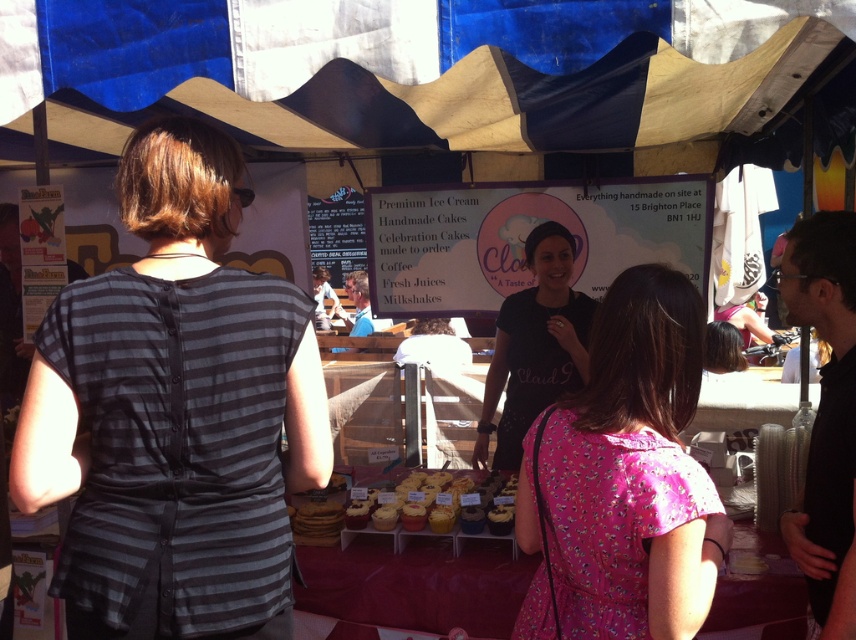
Question: Which point is closer to the camera?

Choices:
 (A) yellow frosted cupcakes at center
 (B) dark gray striped shirt at left

Answer: (B)

Question: Based on their relative distances, which object is nearer to the yellow frosted cupcakes at center?

Choices:
 (A) pink floral dress at center
 (B) black matte shirt at center

Answer: (B)

Question: Does black matte shirt at center have a smaller size compared to yellow frosted cupcakes at center?

Choices:
 (A) no
 (B) yes

Answer: (A)

Question: Is pink floral dress at center closer to the viewer compared to yellow frosted cupcakes at center?

Choices:
 (A) yes
 (B) no

Answer: (A)

Question: Considering the relative positions of dark gray striped shirt at left and black matte shirt at center in the image provided, where is dark gray striped shirt at left located with respect to black matte shirt at center?

Choices:
 (A) left
 (B) right

Answer: (A)

Question: Which of the following is the farthest from the observer?

Choices:
 (A) (82, 314)
 (B) (507, 307)
 (C) (491, 476)

Answer: (B)